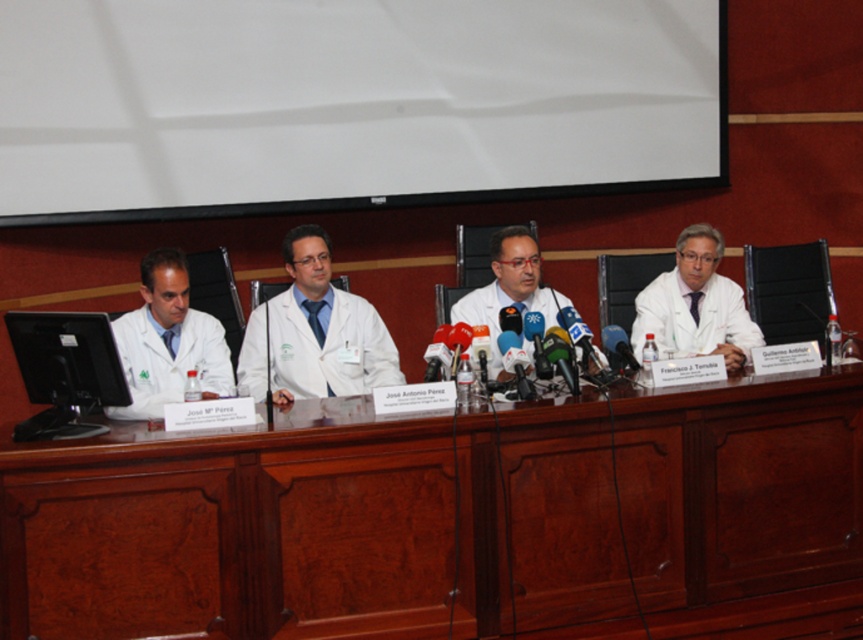
Between point (527, 566) and point (183, 108), which one is positioned in front?

Positioned in front is point (527, 566).

Which of these two, brown wood table at center or white matte projection screen at upper center, stands taller?

With more height is white matte projection screen at upper center.

Looking at this image, who is more distant from viewer, (593, 554) or (181, 42)?

The point (181, 42) is behind.

The width and height of the screenshot is (863, 640). Find the location of `brown wood table at center`. brown wood table at center is located at coordinates (316, 525).

Who is lower down, white lab coat at left or black glossy monitor at left?

black glossy monitor at left is lower down.

Based on the photo, can you confirm if white lab coat at left is thinner than black glossy monitor at left?

No, white lab coat at left is not thinner than black glossy monitor at left.

Does point (137, 353) come in front of point (36, 355)?

That is False.

The height and width of the screenshot is (640, 863). In order to click on white lab coat at left in this screenshot , I will do `click(168, 340)`.

Is white matte projection screen at upper center smaller than white matte lab coat at center?

No.

How far apart are white matte projection screen at upper center and white matte lab coat at center?

white matte projection screen at upper center is 4.25 feet away from white matte lab coat at center.

You are a GUI agent. You are given a task and a screenshot of the screen. Output one action in this format:
    pyautogui.click(x=<x>, y=<y>)
    Task: Click on the white matte projection screen at upper center
    
    Given the screenshot: What is the action you would take?
    pyautogui.click(x=350, y=104)

Locate an element on the screen. white matte projection screen at upper center is located at coordinates (350, 104).